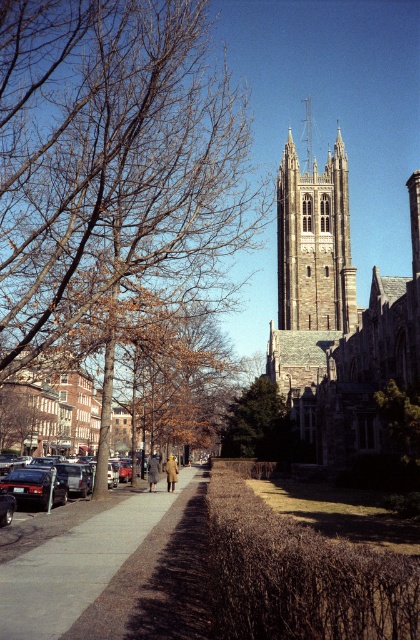
Question: Among these objects, which one is farthest from the camera?

Choices:
 (A) matte black sedan at left
 (B) gray concrete sidewalk at lower left
 (C) brown leafy tree at center-left
 (D) green leafy tree at center-right

Answer: (D)

Question: Observing the image, what is the correct spatial positioning of gray concrete sidewalk at lower left in reference to green leafy tree at center-right?

Choices:
 (A) left
 (B) right

Answer: (A)

Question: Estimate the real-world distances between objects in this image. Which object is farther from the dark brown stone tower at center?

Choices:
 (A) gray concrete sidewalk at lower left
 (B) green leafy tree at center
 (C) brown leafy tree at center-left
 (D) shiny black sedan at lower left

Answer: (D)

Question: Is dark gray stone church at center above gray concrete sidewalk at lower left?

Choices:
 (A) no
 (B) yes

Answer: (B)

Question: In this image, where is brown leafy tree at center-left located relative to green leafy tree at center-right?

Choices:
 (A) right
 (B) left

Answer: (B)

Question: Based on their relative distances, which object is farther from the shiny black sedan at lower left?

Choices:
 (A) dark gray stone church at center
 (B) brown leafy tree at center-left
 (C) gray concrete sidewalk at lower left
 (D) green leafy tree at center

Answer: (A)